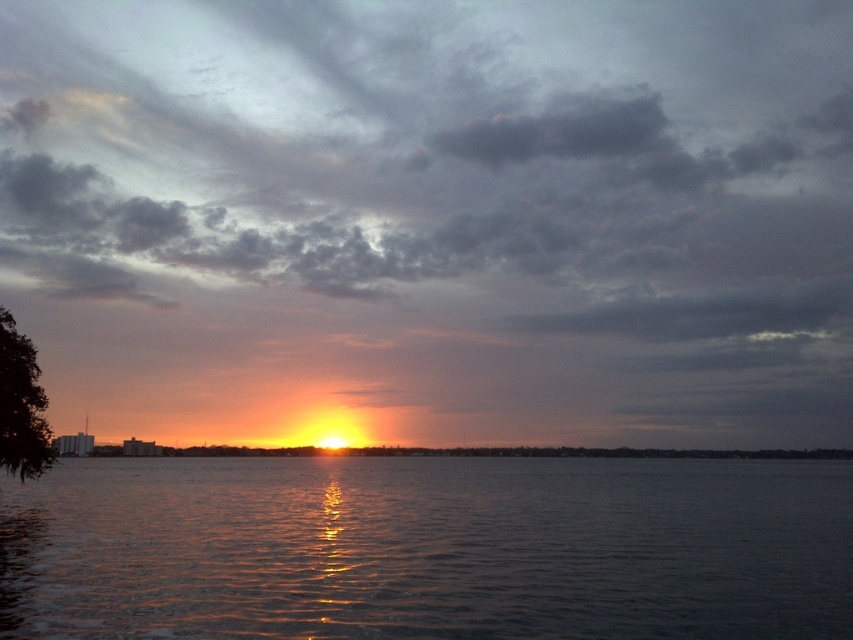
You are standing at the edge of the water in the sunset scene. There is a point marked at coordinates (428, 548) which is glistening dark water at center. Can you describe the color of the water at that point based on the sunset reflection?

The glistening dark water at center reflects the vibrant sunset colors, showing warm oranges and yellows transitioning into cooler purples and blues, creating a shimmering effect.

Based on the photo, you are standing on the shore and see the dark gray cloud at upper center and the glistening dark water at center. Which object is positioned to the right when observing from your perspective?

The dark gray cloud at upper center is positioned to the right of the glistening dark water at center.